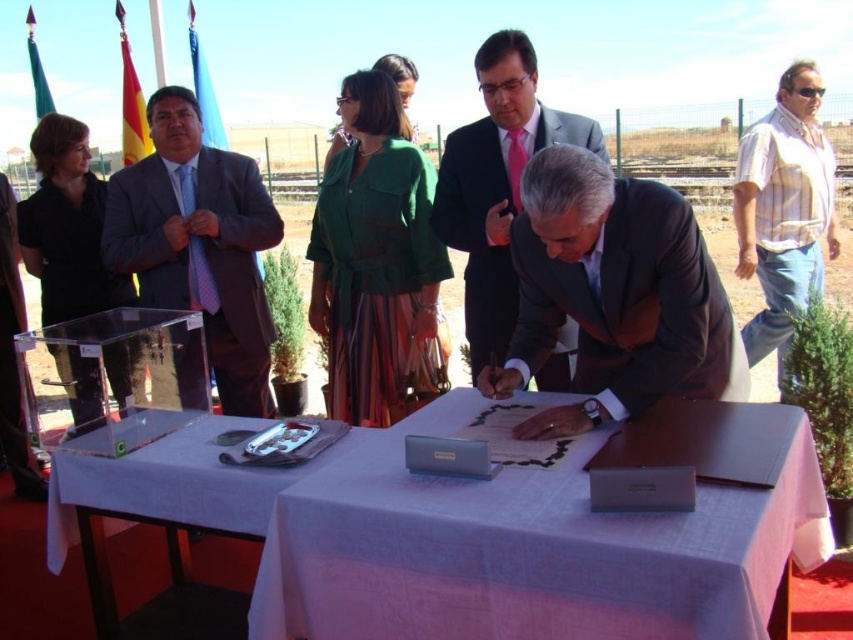
From the picture: You are attending a formal signing ceremony outdoors. You need to locate the dark brown suit at center and the striped cotton shirt at right. Based on their positions, which one is closer to the table?

The dark brown suit at center is located below striped cotton shirt at right, so the dark brown suit at center is closer to the table.

You are standing at the signing ceremony table. There are two points marked on the table surface. The first point is at coordinates point (682, 339), and the second point is at point (814, 246). If you want to place a document closer to the camera, which point should you choose?

Point (682, 339) is closer to the camera than point (814, 246), so you should place the document at point (682, 339) to have it closer to the camera.

You are standing at the center of the image and want to place a new decorative item on the white cloth at center. Based on the coordinates provided, where should you place it?

The white cloth at center is located at coordinates point (531, 545), so place the decorative item there.